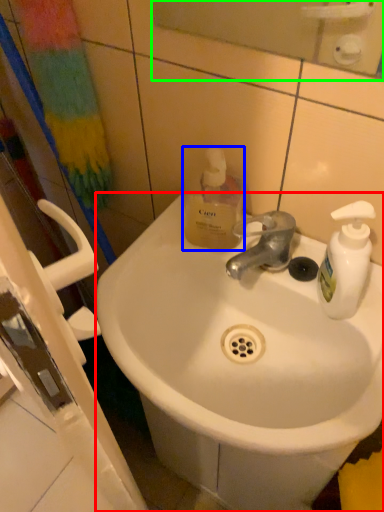
Question: Considering the real-world distances, which object is farthest from sink (highlighted by a red box)? bottle (highlighted by a blue box) or mirror (highlighted by a green box)?

Choices:
 (A) bottle
 (B) mirror

Answer: (B)